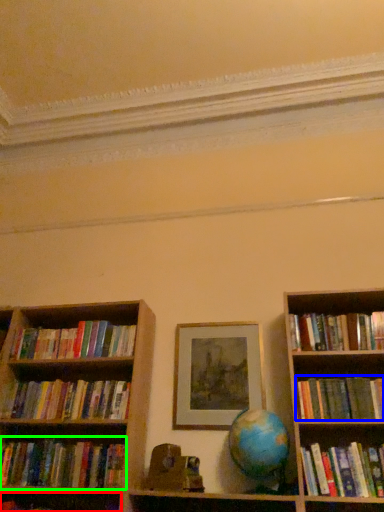
Question: Which object is positioned farthest from book (highlighted by a red box)? Select from book (highlighted by a blue box) and book (highlighted by a green box).

Choices:
 (A) book
 (B) book

Answer: (A)